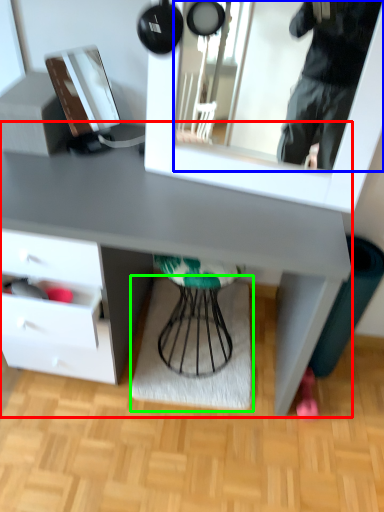
Question: Considering the real-world distances, which object is farthest from desk (highlighted by a red box)? mirror (highlighted by a blue box) or mat (highlighted by a green box)?

Choices:
 (A) mirror
 (B) mat

Answer: (A)